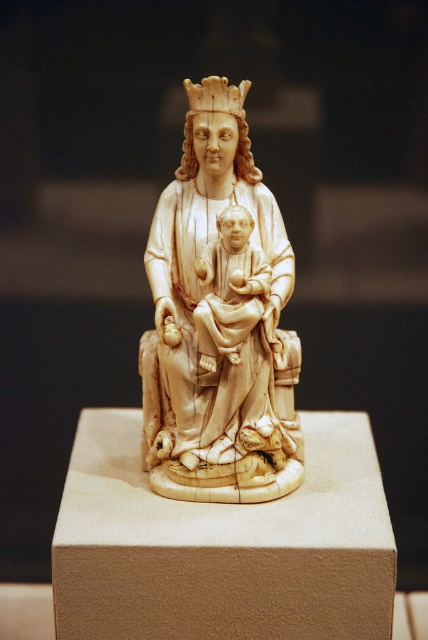
You are an art conservator examining the ivory statue at center and the ivory textured crown at upper center. Which object is positioned higher in the image?

The ivory textured crown at upper center is positioned higher than the ivory statue at center.